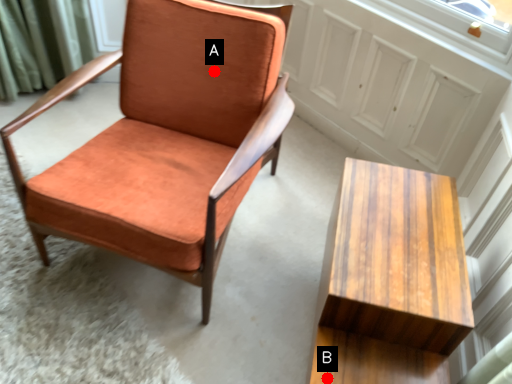
Question: Two points are circled on the image, labeled by A and B beside each circle. Which of the following is the farthest from the observer?

Choices:
 (A) A is further
 (B) B is further

Answer: (A)